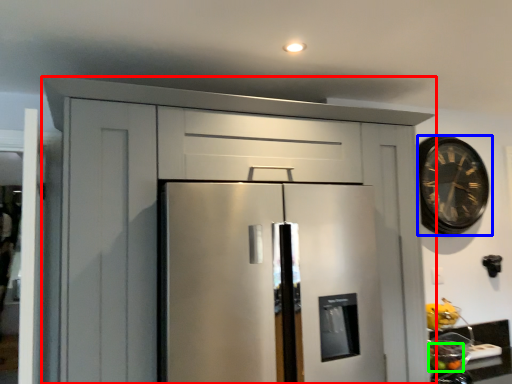
Question: Estimate the real-world distances between objects in this image. Which object is farther from cabinetry (highlighted by a red box), clock (highlighted by a blue box) or fruit (highlighted by a green box)?

Choices:
 (A) clock
 (B) fruit

Answer: (B)